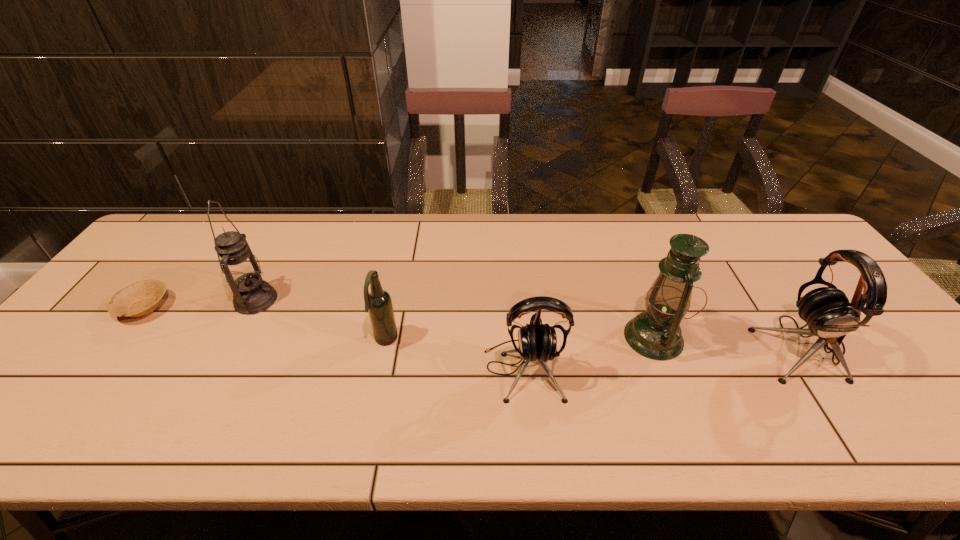
At what (x,y) coordinates should I click in order to perform the action: click on the third object from right to left. Please return your answer as a coordinate pair (x, y). The width and height of the screenshot is (960, 540). Looking at the image, I should click on (536, 341).

Find the location of a particular element. This screenshot has width=960, height=540. the left earphone is located at coordinates (536, 341).

Locate an element on the screen. the rightmost object is located at coordinates (826, 310).

Locate an element on the screen. This screenshot has height=540, width=960. the taller earphone is located at coordinates (826, 310).

Where is `bowl`? The width and height of the screenshot is (960, 540). bowl is located at coordinates (141, 298).

Locate an element on the screen. the leftmost object is located at coordinates (141, 298).

Locate an element on the screen. the left oil lamp is located at coordinates (242, 271).

At what (x,y) coordinates should I click in order to perform the action: click on the fourth object from right to left. Please return your answer as a coordinate pair (x, y). The image size is (960, 540). Looking at the image, I should click on (378, 302).

Identify the location of the fifth object from left to right. This screenshot has height=540, width=960. (656, 334).

The width and height of the screenshot is (960, 540). I want to click on free space located 0.200m on the right of the shorter earphone, so click(648, 370).